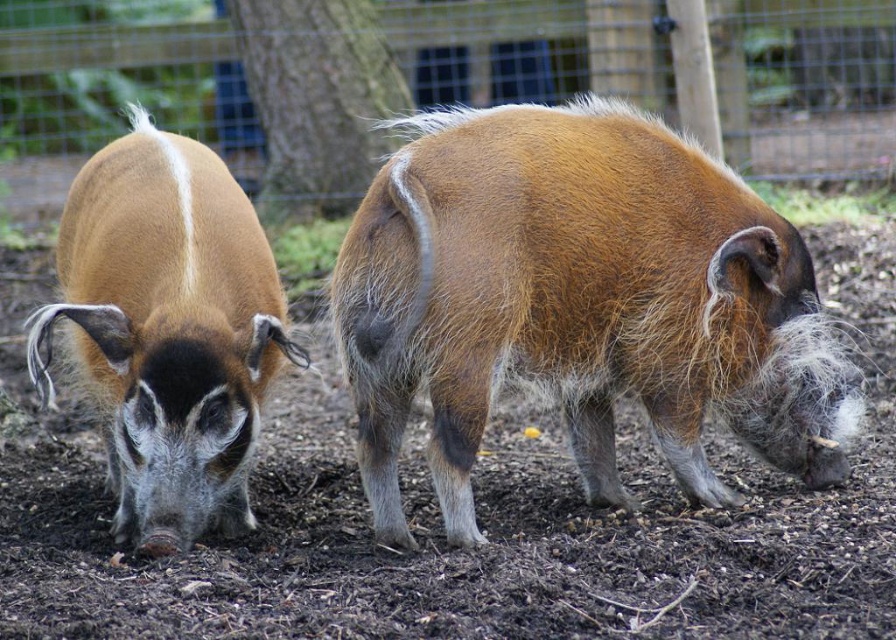
You are a zookeeper observing two points in the warthog enclosure. You need to determine which point is nearer to you. The points are labeled as point 1 at coordinates point (613,160) and point 2 at coordinates point (231,486). Which point is closer to your current position?

Point 1 at coordinates point (613,160) is closer to the camera than point 2 at coordinates point (231,486), so the zookeeper should choose point 1 as the closer point.

You are observing two brown fuzzy pigs in a zoo enclosure. The pigs are labeled as the brown fuzzy pig at center and the brown fuzzy pig at left. From your perspective, which pig is positioned to the right of the other?

The brown fuzzy pig at center is to the right of the brown fuzzy pig at left.

You are a zookeeper who needs to clean the enclosure. You have a shovel that can cover 3 meters in one sweep. The brown soft mud at center and the brown fuzzy pig at left are in your path. Can you clear the mud in one sweep without moving the pig?

The brown soft mud at center is wider than the brown fuzzy pig at left. Since the mud is wider, and the shovel can cover 3 meters, you need to check the actual width of the mud. However, the description only states that the mud is wider than the pig but doesn not provide exact measurements. Without knowing the exact width of the mud, it is uncertain if the shovel can clear it in one sweep.